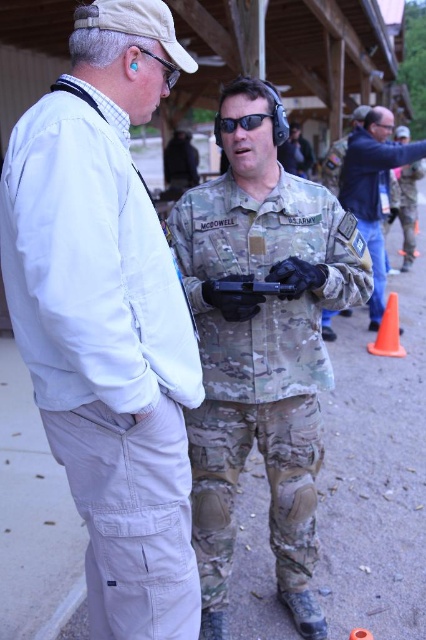
Question: Which point appears farthest from the camera in this image?

Choices:
 (A) (175, 68)
 (B) (74, 250)
 (C) (391, 337)

Answer: (C)

Question: Which of the following is the farthest from the observer?

Choices:
 (A) camouflage uniform at center
 (B) matte black goggles at upper left

Answer: (A)

Question: Among these objects, which one is farthest from the camera?

Choices:
 (A) matte black goggles at upper left
 (B) camouflage fabric uniform at center
 (C) camouflage uniform at right
 (D) khaki cotton pants at lower left

Answer: (C)

Question: Where is khaki cotton pants at lower left located in relation to camouflage uniform at right in the image?

Choices:
 (A) right
 (B) left

Answer: (B)

Question: From the image, what is the correct spatial relationship of khaki cotton pants at lower left in relation to matte black goggles at upper left?

Choices:
 (A) right
 (B) left

Answer: (B)

Question: Is camouflage fabric uniform at center to the right of camouflage uniform at center from the viewer's perspective?

Choices:
 (A) no
 (B) yes

Answer: (A)